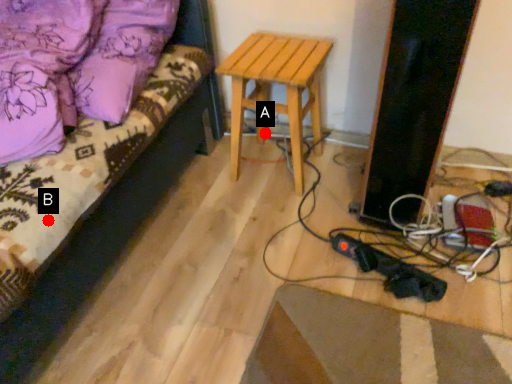
Question: Two points are circled on the image, labeled by A and B beside each circle. Which of the following is the closest to the observer?

Choices:
 (A) A is closer
 (B) B is closer

Answer: (B)